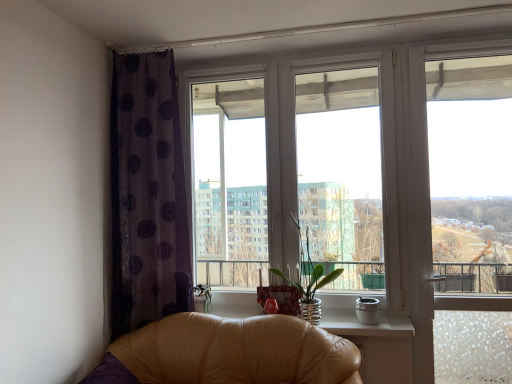
Locate an element on the screen. free space above purple sheer curtain at left (from a real-world perspective) is located at coordinates (149, 50).